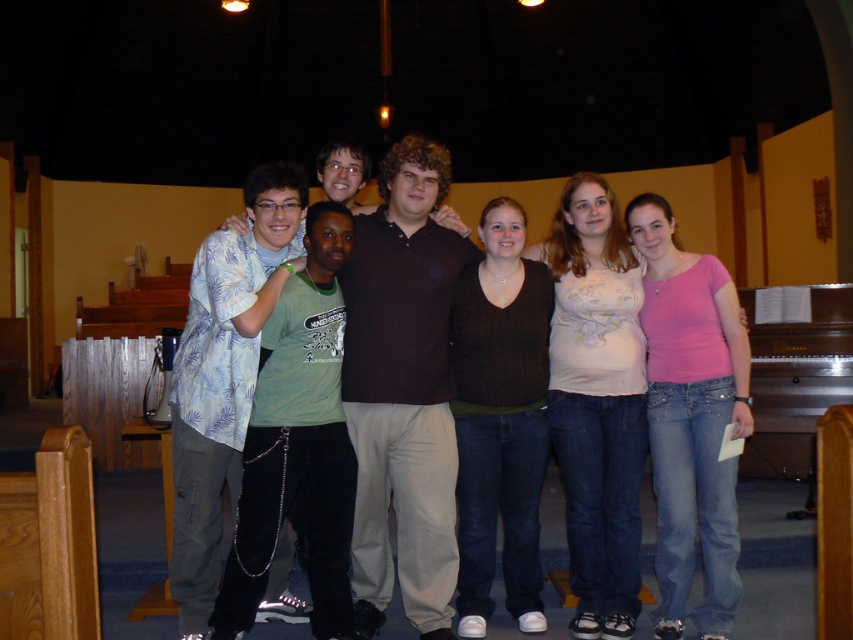
You are standing in front of the group and want to greet the person wearing the brown cotton shirt at center and the light blue floral shirt at center. Which one is closer to you?

The brown cotton shirt at center is closer to you than the light blue floral shirt at center because it is further to the viewer.